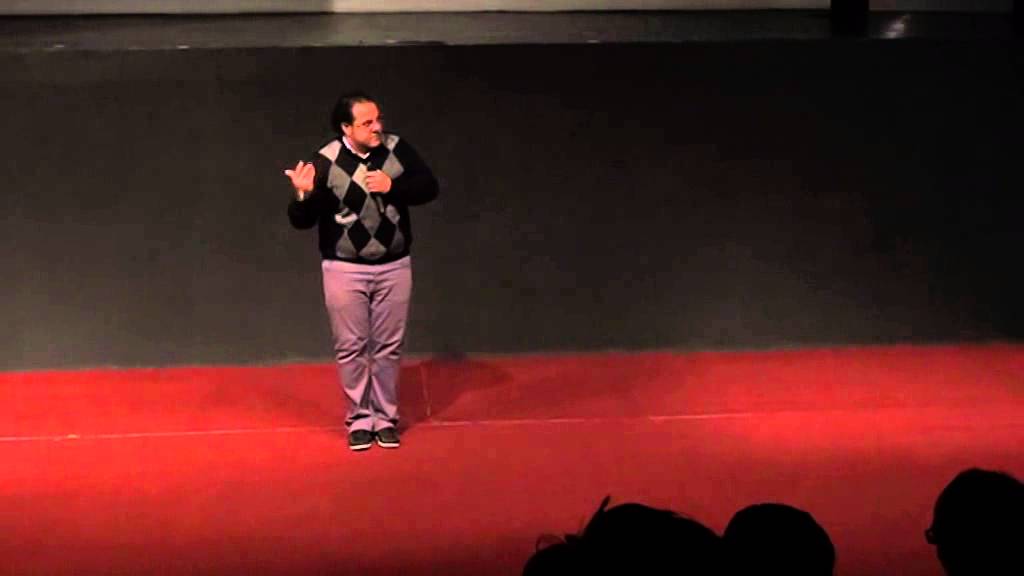
Locate an element on the screen. The image size is (1024, 576). floor is located at coordinates (243, 457).